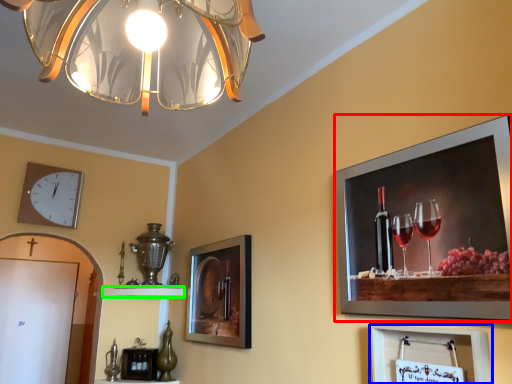
Question: Considering the real-world distances, which object is closest to picture frame (highlighted by a red box)? picture frame (highlighted by a blue box) or shelf (highlighted by a green box).

Choices:
 (A) picture frame
 (B) shelf

Answer: (A)